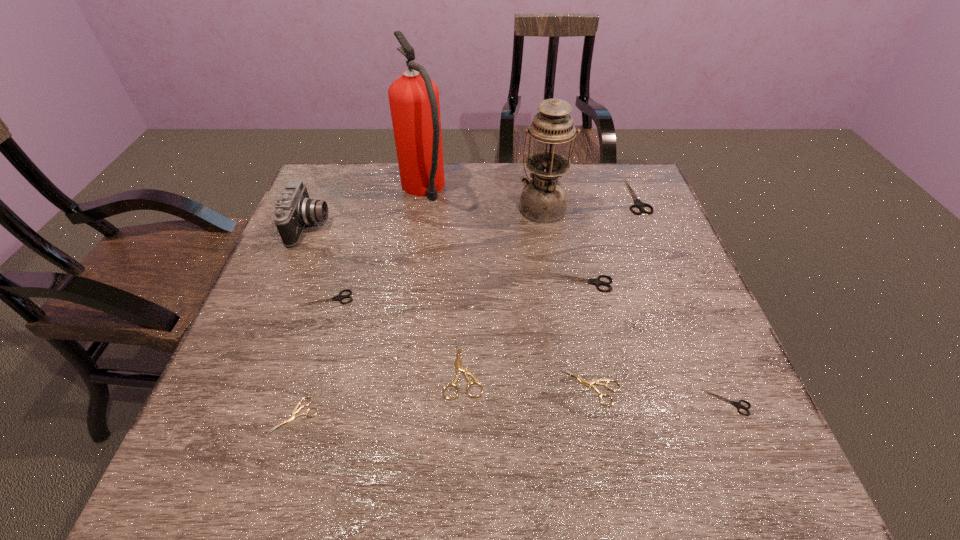
The image size is (960, 540). Find the location of `vacant region between the second smallest beige shears and the shortest object`. vacant region between the second smallest beige shears and the shortest object is located at coordinates (444, 401).

Find the location of a particular element. This screenshot has height=540, width=960. unoccupied area between the sixth shortest object and the leftmost black shears is located at coordinates point(454,291).

Locate an element on the screen. vacant area that lies between the leftmost black shears and the black camera is located at coordinates (319, 262).

Locate an element on the screen. The height and width of the screenshot is (540, 960). vacant space that is in between the smallest black shears and the oil lamp is located at coordinates (635, 305).

Find the location of a particular element. The width and height of the screenshot is (960, 540). free space between the second biggest beige shears and the red fire extinguisher is located at coordinates (508, 289).

This screenshot has width=960, height=540. Find the location of `vacant point located between the second tallest shears and the rightmost beige shears`. vacant point located between the second tallest shears and the rightmost beige shears is located at coordinates (587, 335).

Locate an element on the screen. free space that is in between the fifth shears from right to left and the shortest shears is located at coordinates (379, 391).

Identify the location of vacant area between the smallest black shears and the biggest black shears. (682, 299).

The height and width of the screenshot is (540, 960). I want to click on free spot between the smallest beige shears and the camera, so click(x=302, y=321).

Locate an element on the screen. This screenshot has height=540, width=960. object that is the second closest to the camera is located at coordinates (414, 102).